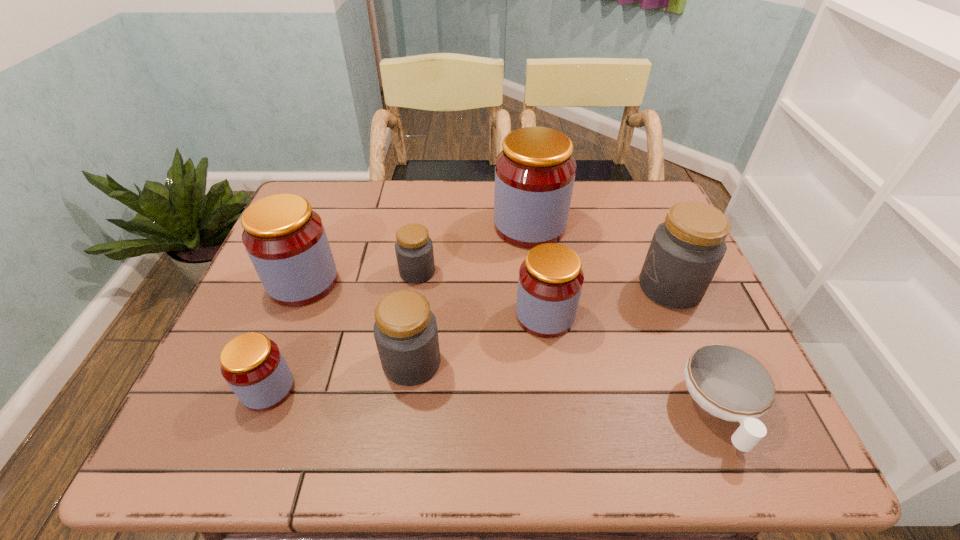
This screenshot has height=540, width=960. Find the location of `white chinaware`. white chinaware is located at coordinates (727, 382).

Identify the location of vacant region located 0.340m on the left of the tallest jar. (377, 226).

The height and width of the screenshot is (540, 960). Identify the location of free region located on the surface of the rightmost gray jar near the warning symbol. [x=564, y=288].

Locate an element on the screen. free region located on the surface of the rightmost gray jar near the warning symbol is located at coordinates (564, 288).

Find the location of a particular element. The height and width of the screenshot is (540, 960). free space located on the surface of the rightmost gray jar near the warning symbol is located at coordinates (567, 288).

I want to click on free space located on the right of the third smallest red jar, so click(400, 282).

The height and width of the screenshot is (540, 960). Find the location of `vacant space located 0.210m on the surface of the nearest gray jar near the warning symbol`. vacant space located 0.210m on the surface of the nearest gray jar near the warning symbol is located at coordinates (538, 363).

Image resolution: width=960 pixels, height=540 pixels. I want to click on free spot located on the right of the third biggest red jar, so click(659, 315).

You are a GUI agent. You are given a task and a screenshot of the screen. Output one action in this format:
    pyautogui.click(x=<x>, y=<y>)
    Task: Click on the vacant space located 0.380m on the surface of the smallest gray jar near the warning symbol
    
    Given the screenshot: What is the action you would take?
    pyautogui.click(x=581, y=272)

Find the location of `free spot located 0.080m on the back of the smallest red jar`. free spot located 0.080m on the back of the smallest red jar is located at coordinates (288, 338).